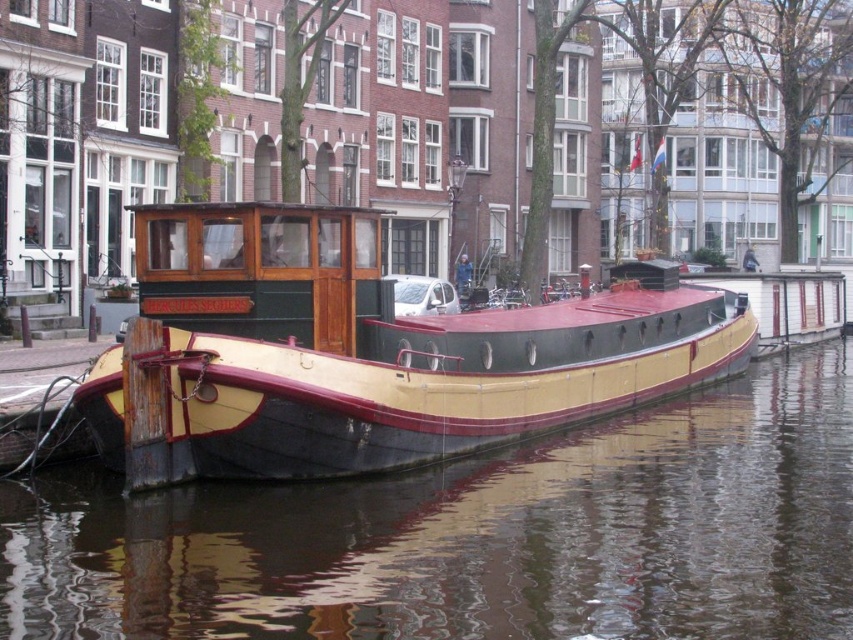
Question: Which point is farther from the camera taking this photo?

Choices:
 (A) (579, 346)
 (B) (421, 509)

Answer: (A)

Question: Can you confirm if smooth water at center is positioned above wooden cabin cruiser at center?

Choices:
 (A) no
 (B) yes

Answer: (A)

Question: Is smooth water at center to the right of wooden cabin cruiser at center from the viewer's perspective?

Choices:
 (A) yes
 (B) no

Answer: (A)

Question: Is smooth water at center positioned before wooden cabin cruiser at center?

Choices:
 (A) no
 (B) yes

Answer: (B)